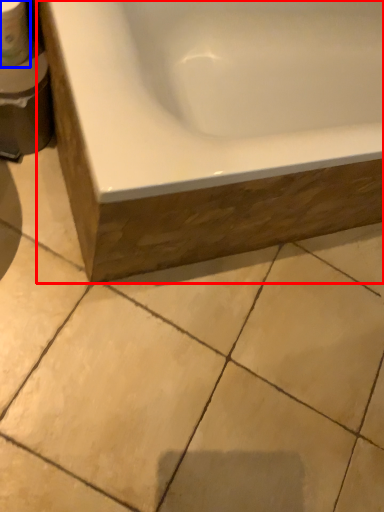
Question: Which point is closer to the camera, bathtub (highlighted by a red box) or toilet paper (highlighted by a blue box)?

Choices:
 (A) bathtub
 (B) toilet paper

Answer: (A)